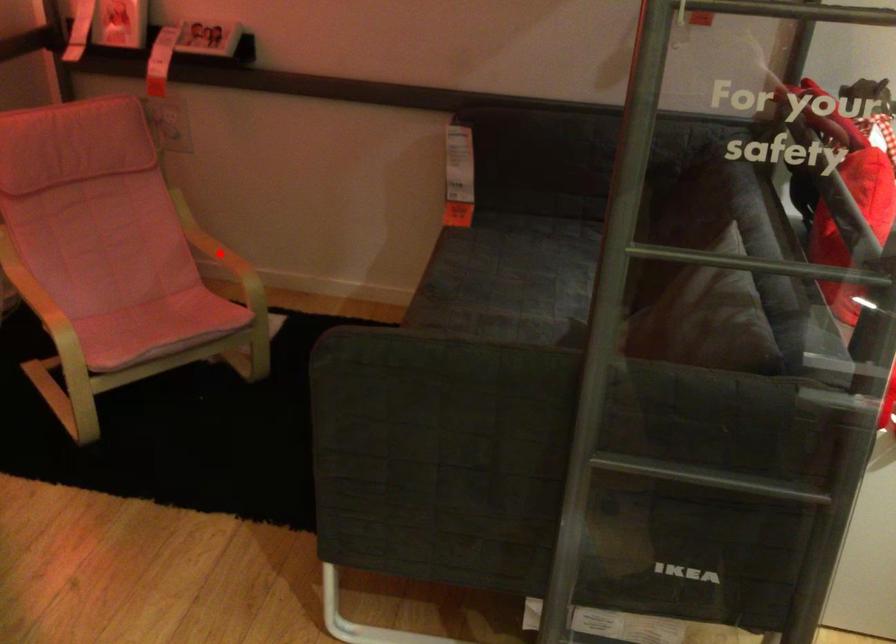
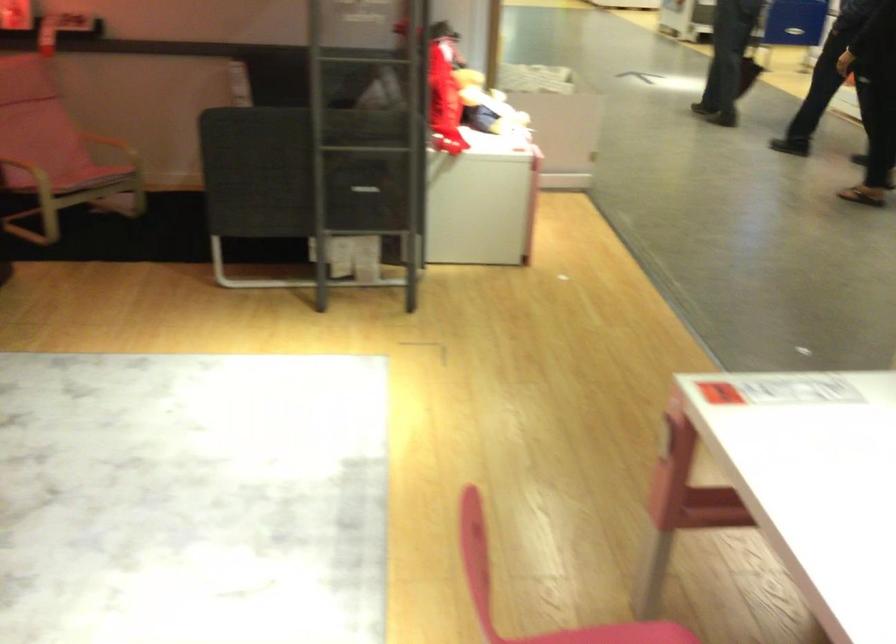
Question: I am providing you with two images of the same scene from different viewpoints. Given a red point in image1, look at the same physical point in image2. Is it:

Choices:
 (A) Closer to the viewpoint
 (B) Farther from the viewpoint

Answer: (B)